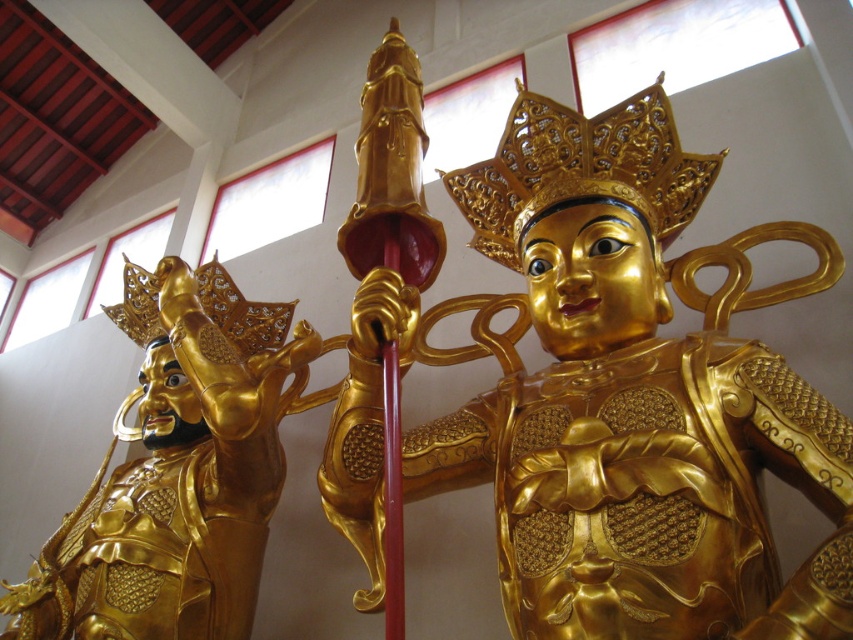
You are an art conservator assessing the placement of two golden artifacts in a temple. You see the gold polished statue at center and the gold polished armor at left. Which artifact is located to the right of the other?

The gold polished statue at center is positioned on the right side of gold polished armor at left, meaning the statue is to the right of the armor.

You are an art conservator assessing the spatial arrangement of the statues in the temple. Given that the gold polished statue at center and the gold polished armor at left are both displayed in the same room, which one would cast a shorter shadow when the sun is directly overhead?

The gold polished statue at center is not as tall as the gold polished armor at left, so it would cast a shorter shadow.

You are an art conservator assessing the placement of two gold polished items in a temple. You need to ensure that the smaller item is placed on a pedestal that can support its weight. Given that the gold polished statue at center and the gold polished armor at left are both present, which item requires a pedestal with a smaller base area?

The gold polished statue at center is smaller than the gold polished armor at left, so it requires a pedestal with a smaller base area.